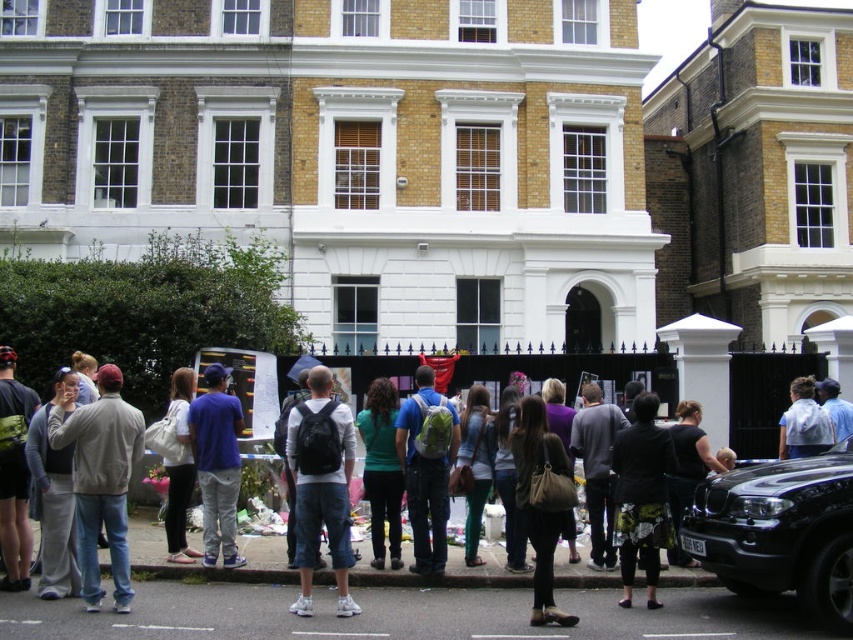
From the picture: Measure the distance between point (241,412) and camera.

Point (241,412) and camera are 24.77 meters apart from each other.

Who is taller, blue fabric cap at center or light blue shirt at center?

blue fabric cap at center

You are a GUI agent. You are given a task and a screenshot of the screen. Output one action in this format:
    pyautogui.click(x=<x>, y=<y>)
    Task: Click on the blue fabric cap at center
    This screenshot has height=640, width=853.
    Given the screenshot: What is the action you would take?
    [218, 464]

Who is positioned more to the right, floral-patterned skirt at center or blue denim jeans at center?

blue denim jeans at center is more to the right.

Can you confirm if floral-patterned skirt at center is wider than blue denim jeans at center?

Indeed, floral-patterned skirt at center has a greater width compared to blue denim jeans at center.

What do you see at coordinates (641, 497) in the screenshot?
I see `floral-patterned skirt at center` at bounding box center [641, 497].

Locate an element on the screen. floral-patterned skirt at center is located at coordinates (641, 497).

Is point (798, 582) behind point (480, 634)?

No, (798, 582) is in front of (480, 634).

Is black matte suv at lower right shorter than metallic silver car at center?

Incorrect, black matte suv at lower right's height does not fall short of metallic silver car at center's.

Find the location of a particular element. Image resolution: width=853 pixels, height=640 pixels. black matte suv at lower right is located at coordinates (780, 532).

Find the location of a particular element. black matte suv at lower right is located at coordinates (780, 532).